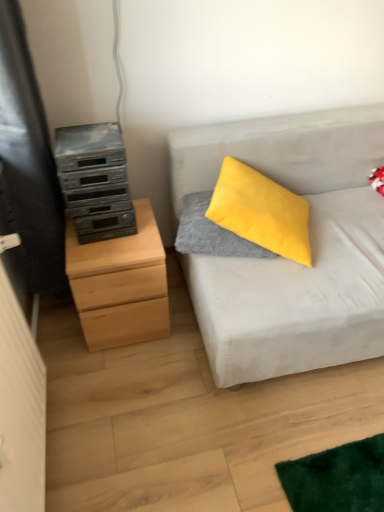
The width and height of the screenshot is (384, 512). What are the coordinates of `vacant region in front of natural wood chest of drawers at left` in the screenshot? It's located at tap(126, 380).